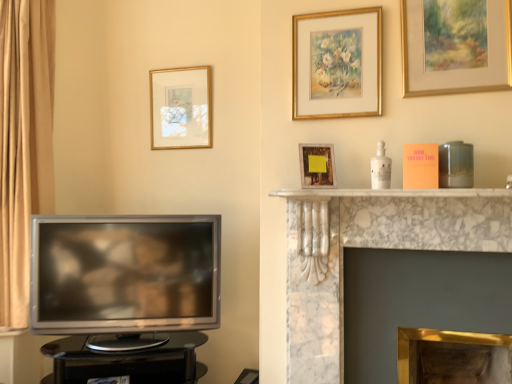
The height and width of the screenshot is (384, 512). What do you see at coordinates (389, 193) in the screenshot?
I see `white marble fireplace at upper center` at bounding box center [389, 193].

Describe the element at coordinates (124, 277) in the screenshot. I see `satin silver television at left` at that location.

What do you see at coordinates (370, 247) in the screenshot? The height and width of the screenshot is (384, 512). I see `white marble fireplace at center, which appears as the 1th fireplace when viewed from the top` at bounding box center [370, 247].

The height and width of the screenshot is (384, 512). I want to click on gold/gilded picture frame at upper center, which is counted as the 3th picture frame, starting from the left, so click(337, 64).

Where is `black glossy table at lower left`? The image size is (512, 384). black glossy table at lower left is located at coordinates (127, 361).

What do you see at coordinates (181, 108) in the screenshot? I see `gold-framed picture at upper center, which is the first picture frame from left to right` at bounding box center [181, 108].

At what (x,y) coordinates should I click in order to perform the action: click on gold-framed painting at upper right, which is the 4th picture frame from left to right. Please return your answer as a coordinate pair (x, y). The width and height of the screenshot is (512, 384). Looking at the image, I should click on (456, 46).

Between black glossy table at lower left and gold/gilded picture frame at upper center, marked as the 2th picture frame in a back-to-front arrangement, which one has smaller width?

With smaller width is gold/gilded picture frame at upper center, marked as the 2th picture frame in a back-to-front arrangement.

Who is more distant, black glossy table at lower left or gold/gilded picture frame at upper center, marked as the 2th picture frame in a back-to-front arrangement?

gold/gilded picture frame at upper center, marked as the 2th picture frame in a back-to-front arrangement.

Is black glossy table at lower left inside the boundaries of gold/gilded picture frame at upper center, the second picture frame in the right-to-left sequence, or outside?

black glossy table at lower left lies outside gold/gilded picture frame at upper center, the second picture frame in the right-to-left sequence.

Could you tell me if black glossy table at lower left is turned towards gold/gilded picture frame at upper center, which is counted as the 3th picture frame, starting from the left?

No, black glossy table at lower left does not turn towards gold/gilded picture frame at upper center, which is counted as the 3th picture frame, starting from the left.

From the image's perspective, is satin silver television at left located beneath white marble fireplace at upper center?

Yes, from the image's perspective, satin silver television at left is beneath white marble fireplace at upper center.

Is satin silver television at left at the right side of white marble fireplace at upper center?

Incorrect, satin silver television at left is not on the right side of white marble fireplace at upper center.

Considering the sizes of satin silver television at left and white marble fireplace at upper center in the image, is satin silver television at left taller or shorter than white marble fireplace at upper center?

Clearly, satin silver television at left is taller compared to white marble fireplace at upper center.

Which of these two, satin silver television at left or white marble fireplace at upper center, is wider?

white marble fireplace at upper center is wider.

Measure the distance from black glossy table at lower left to gold-framed picture at upper center, the 4th picture frame positioned from the right.

black glossy table at lower left and gold-framed picture at upper center, the 4th picture frame positioned from the right, are 4.15 feet apart from each other.

Is black glossy table at lower left aimed at gold-framed picture at upper center, positioned as the first picture frame in back-to-front order?

No, black glossy table at lower left does not turn towards gold-framed picture at upper center, positioned as the first picture frame in back-to-front order.

Considering the positions of point (199, 339) and point (201, 138), is point (199, 339) closer or farther from the camera than point (201, 138)?

Clearly, point (199, 339) is closer to the camera than point (201, 138).

Would you say black glossy table at lower left is a long distance from gold-framed picture at upper center, marked as the 4th picture frame in a front-to-back arrangement?

Yes.

Is point (188, 335) more distant than point (410, 85)?

That is True.

From a real-world perspective, is black glossy table at lower left positioned over gold-framed painting at upper right, the 1th picture frame viewed from the front, based on gravity?

No, from a real-world perspective, black glossy table at lower left is not above gold-framed painting at upper right, the 1th picture frame viewed from the front.

In the scene shown: Which is correct: black glossy table at lower left is inside gold-framed painting at upper right, which is the 4th picture frame from back to front, or outside of it?

black glossy table at lower left is not inside gold-framed painting at upper right, which is the 4th picture frame from back to front, it's outside.

Does gold-framed painting at upper right, which is the 4th picture frame from back to front, lie behind white marble fireplace at center, acting as the 2th fireplace starting from the bottom?

That is True.

Is gold-framed painting at upper right, arranged as the first picture frame when viewed from the right, aimed at white marble fireplace at center, which appears as the 1th fireplace when viewed from the top?

No, gold-framed painting at upper right, arranged as the first picture frame when viewed from the right, is not aimed at white marble fireplace at center, which appears as the 1th fireplace when viewed from the top.

Does gold-framed painting at upper right, arranged as the first picture frame when viewed from the right, have a smaller size compared to white marble fireplace at center, which appears as the 1th fireplace when viewed from the top?

Indeed, gold-framed painting at upper right, arranged as the first picture frame when viewed from the right, has a smaller size compared to white marble fireplace at center, which appears as the 1th fireplace when viewed from the top.

From a real-world perspective, is gold-framed painting at upper right, which is the 4th picture frame from back to front, positioned above or below white marble fireplace at center, acting as the 2th fireplace starting from the bottom?

From a real-world perspective, gold-framed painting at upper right, which is the 4th picture frame from back to front, is physically above white marble fireplace at center, acting as the 2th fireplace starting from the bottom.

Is the position of black glossy table at lower left less distant than that of white marble fireplace at center, which appears as the 1th fireplace when viewed from the top?

No.

Looking at the image, does black glossy table at lower left seem bigger or smaller compared to white marble fireplace at center, which appears as the 1th fireplace when viewed from the top?

Considering their sizes, black glossy table at lower left takes up less space than white marble fireplace at center, which appears as the 1th fireplace when viewed from the top.

Is black glossy table at lower left not close to white marble fireplace at center, acting as the 2th fireplace starting from the bottom?

No, black glossy table at lower left is in close proximity to white marble fireplace at center, acting as the 2th fireplace starting from the bottom.

Which object is positioned more to the right, black glossy table at lower left or white marble fireplace at center, which appears as the 1th fireplace when viewed from the top?

From the viewer's perspective, white marble fireplace at center, which appears as the 1th fireplace when viewed from the top, appears more on the right side.

Considering the relative sizes of satin silver television at left and black glossy table at lower left in the image provided, is satin silver television at left wider than black glossy table at lower left?

In fact, satin silver television at left might be narrower than black glossy table at lower left.

From the picture: Between satin silver television at left and black glossy table at lower left, which one has more height?

satin silver television at left.

Is satin silver television at left looking in the opposite direction of black glossy table at lower left?

No, satin silver television at left's orientation is not away from black glossy table at lower left.

How many degrees apart are the facing directions of satin silver television at left and black glossy table at lower left?

The facing directions of satin silver television at left and black glossy table at lower left are 1.93 degrees apart.

Where is `picture frame that is the 1st one when counting backward from the black glossy table at lower left`? picture frame that is the 1st one when counting backward from the black glossy table at lower left is located at coordinates (337, 64).

You are a GUI agent. You are given a task and a screenshot of the screen. Output one action in this format:
    pyautogui.click(x=<x>, y=<y>)
    Task: Click on the television on the left of white marble fireplace at upper center
    The width and height of the screenshot is (512, 384).
    Given the screenshot: What is the action you would take?
    pyautogui.click(x=124, y=277)

Which object lies further to the anchor point gold-framed painting at upper right, which is the 4th picture frame from left to right, gold/gilded picture frame at upper center, marked as the 2th picture frame in a back-to-front arrangement, or matte wooden picture frame at upper center, which appears as the third picture frame when viewed from the right?

matte wooden picture frame at upper center, which appears as the third picture frame when viewed from the right, is further to gold-framed painting at upper right, which is the 4th picture frame from left to right.

Considering their positions, is gold-framed picture at upper center, marked as the 4th picture frame in a front-to-back arrangement, positioned further to matte wooden picture frame at upper center, which appears as the third picture frame when viewed from the right, than gold/gilded picture frame at upper center, which is counted as the 3th picture frame, starting from the left?

gold-framed picture at upper center, marked as the 4th picture frame in a front-to-back arrangement, is positioned further to the anchor matte wooden picture frame at upper center, which appears as the third picture frame when viewed from the right.

From the image, which object appears to be farther from satin silver television at left, gold metallic fireplace at center, the 2th fireplace positioned from the top, or matte wooden picture frame at upper center, which appears as the third picture frame when viewed from the right?

gold metallic fireplace at center, the 2th fireplace positioned from the top, is further to satin silver television at left.

Based on the photo, considering their positions, is black glossy table at lower left positioned further to white marble fireplace at center, which appears as the 1th fireplace when viewed from the top, than satin silver television at left?

Based on the image, black glossy table at lower left appears to be further to white marble fireplace at center, which appears as the 1th fireplace when viewed from the top.

Which object lies nearer to the anchor point gold metallic fireplace at center, acting as the 1th fireplace starting from the bottom, white marble fireplace at center, which appears as the 1th fireplace when viewed from the top, or black glossy table at lower left?

Based on the image, white marble fireplace at center, which appears as the 1th fireplace when viewed from the top, appears to be nearer to gold metallic fireplace at center, acting as the 1th fireplace starting from the bottom.

From the image, which object appears to be farther from gold/gilded picture frame at upper center, marked as the 2th picture frame in a back-to-front arrangement, gold-framed picture at upper center, marked as the 4th picture frame in a front-to-back arrangement, or gold metallic fireplace at center, acting as the 1th fireplace starting from the bottom?

Among the two, gold metallic fireplace at center, acting as the 1th fireplace starting from the bottom, is located further to gold/gilded picture frame at upper center, marked as the 2th picture frame in a back-to-front arrangement.

Based on their spatial positions, is matte wooden picture frame at upper center, which ranks as the 3th picture frame in back-to-front order, or white marble fireplace at center, acting as the 2th fireplace starting from the bottom, closer to black glossy table at lower left?

Among the two, white marble fireplace at center, acting as the 2th fireplace starting from the bottom, is located nearer to black glossy table at lower left.

Based on their spatial positions, is satin silver television at left or black glossy table at lower left closer to white marble fireplace at center, acting as the 2th fireplace starting from the bottom?

satin silver television at left is closer to white marble fireplace at center, acting as the 2th fireplace starting from the bottom.

Identify the location of fireplace between white marble fireplace at upper center and gold metallic fireplace at center, the 2th fireplace positioned from the top, from top to bottom. Image resolution: width=512 pixels, height=384 pixels. (370, 247).

You are a GUI agent. You are given a task and a screenshot of the screen. Output one action in this format:
    pyautogui.click(x=<x>, y=<y>)
    Task: Click on the fireplace between gold-framed picture at upper center, the 4th picture frame positioned from the right, and gold metallic fireplace at center, acting as the 1th fireplace starting from the bottom, in the horizontal direction
    
    Given the screenshot: What is the action you would take?
    pyautogui.click(x=370, y=247)

At what (x,y) coordinates should I click in order to perform the action: click on mantle that lies between matte wooden picture frame at upper center, which is the 2th picture frame from left to right, and white marble fireplace at center, acting as the 2th fireplace starting from the bottom, from top to bottom. Please return your answer as a coordinate pair (x, y). This screenshot has height=384, width=512. Looking at the image, I should click on (389, 193).

The image size is (512, 384). Find the location of `mantle between gold/gilded picture frame at upper center, the second picture frame in the right-to-left sequence, and gold metallic fireplace at center, the 2th fireplace positioned from the top, in the up-down direction`. mantle between gold/gilded picture frame at upper center, the second picture frame in the right-to-left sequence, and gold metallic fireplace at center, the 2th fireplace positioned from the top, in the up-down direction is located at coordinates (389, 193).